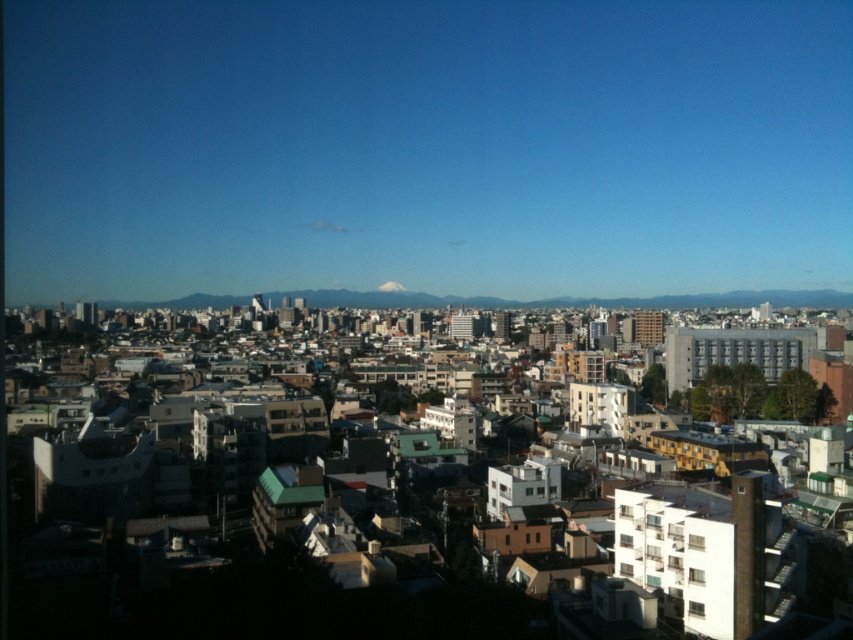
Question: Which point appears farthest from the camera in this image?

Choices:
 (A) (285, 550)
 (B) (376, 288)

Answer: (B)

Question: Observing the image, what is the correct spatial positioning of white matte building at center in reference to snowy mountain peak at center?

Choices:
 (A) below
 (B) above

Answer: (A)

Question: Is white matte building at center closer to camera compared to snowy mountain peak at center?

Choices:
 (A) yes
 (B) no

Answer: (A)

Question: Where is white matte building at center located in relation to snowy mountain peak at center in the image?

Choices:
 (A) right
 (B) left

Answer: (B)

Question: Among these points, which one is nearest to the camera?

Choices:
 (A) (398, 284)
 (B) (24, 525)

Answer: (B)

Question: Which point is closer to the camera?

Choices:
 (A) click(x=355, y=604)
 (B) click(x=392, y=280)

Answer: (A)